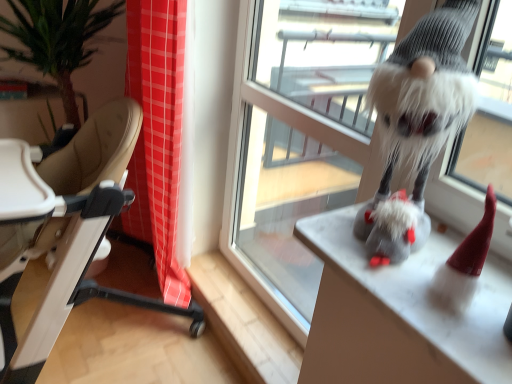
Question: Considering the positions of point (381, 347) and point (253, 183), is point (381, 347) closer or farther from the camera than point (253, 183)?

Choices:
 (A) farther
 (B) closer

Answer: (B)

Question: In the image, is fuzzy gray gnome at right on the left side or the right side of transparent glass window at center?

Choices:
 (A) right
 (B) left

Answer: (A)

Question: Which of these objects is positioned closest to the fuzzy gray gnome at right?

Choices:
 (A) transparent glass window at center
 (B) fuzzy gray gnome at upper right
 (C) beige leather highchair at left

Answer: (B)

Question: Considering the real-world distances, which object is farthest from the fuzzy gray gnome at right?

Choices:
 (A) beige leather highchair at left
 (B) fuzzy gray gnome at upper right
 (C) transparent glass window at center

Answer: (A)